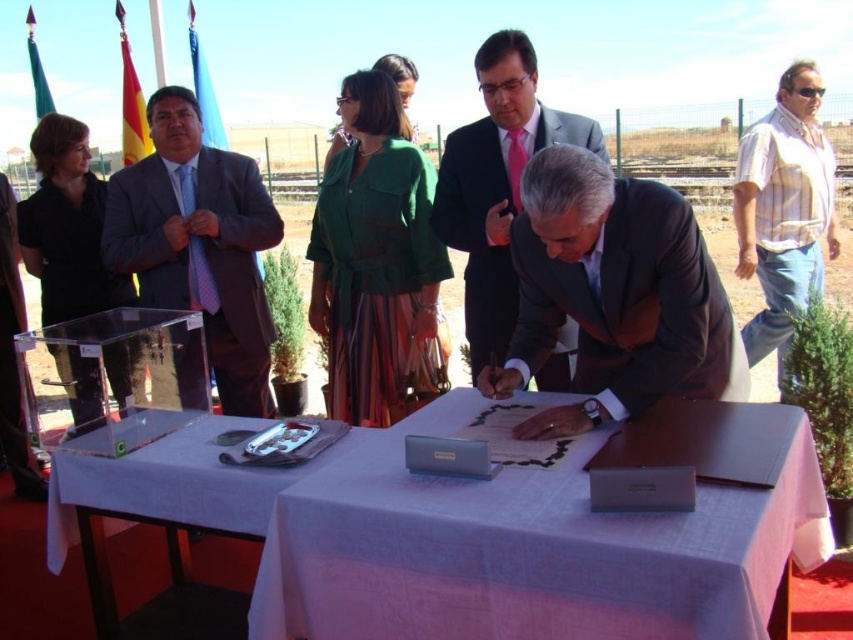
Question: Can you confirm if white cloth at center is positioned below striped cotton shirt at right?

Choices:
 (A) yes
 (B) no

Answer: (A)

Question: Based on their relative distances, which object is nearer to the striped cotton shirt at right?

Choices:
 (A) white cloth-covered table at center
 (B) matte purple tie at left
 (C) light gray suit at center

Answer: (C)

Question: Is white cloth at center positioned in front of light gray suit at center?

Choices:
 (A) yes
 (B) no

Answer: (A)

Question: Which object is positioned farthest from the white cloth at center?

Choices:
 (A) light gray suit at center
 (B) white cloth-covered table at center
 (C) dark brown suit at center
 (D) striped cotton shirt at right

Answer: (D)

Question: Is light gray suit at center bigger than striped cotton shirt at right?

Choices:
 (A) yes
 (B) no

Answer: (B)

Question: Which object is the farthest from the light gray suit at center?

Choices:
 (A) dark brown suit at center
 (B) matte purple tie at left
 (C) white cloth-covered table at center

Answer: (C)